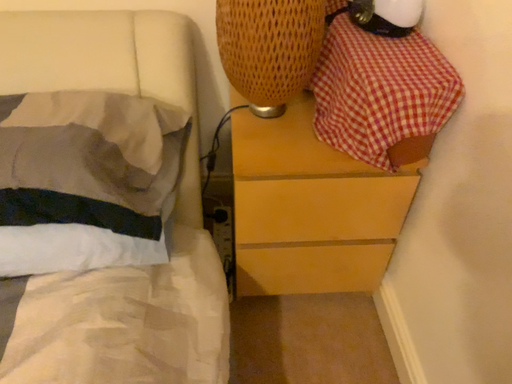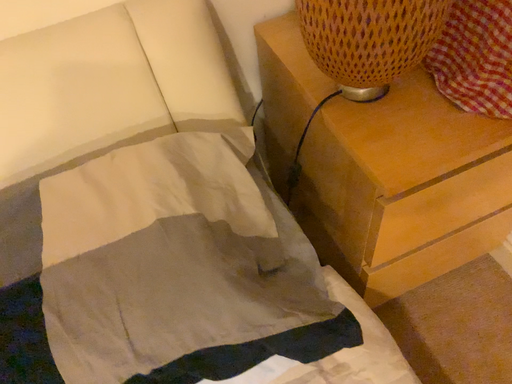
Question: How did the camera likely rotate when shooting the video?

Choices:
 (A) rotated upward
 (B) rotated downward

Answer: (B)